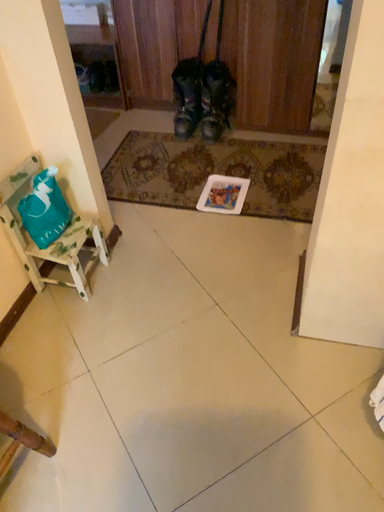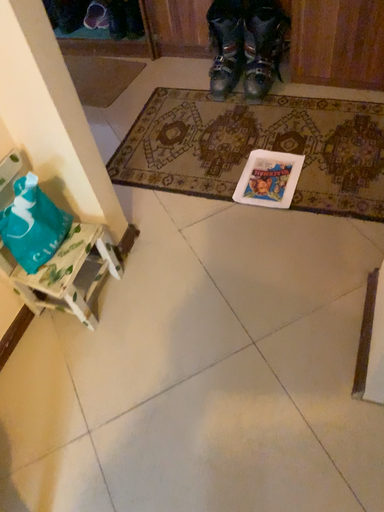
Question: Which way did the camera rotate in the video?

Choices:
 (A) rotated left
 (B) rotated right

Answer: (A)